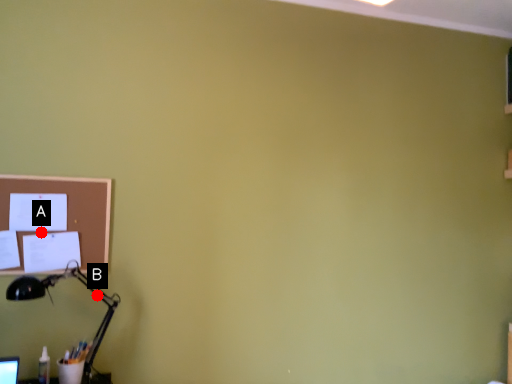
Question: Two points are circled on the image, labeled by A and B beside each circle. Which point is farther from the camera taking this photo?

Choices:
 (A) A is further
 (B) B is further

Answer: (B)